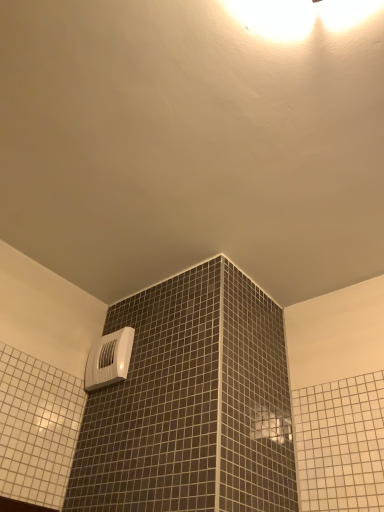
Identify the location of white plastic air conditioning unit at upper left. (109, 359).

The width and height of the screenshot is (384, 512). What do you see at coordinates (109, 359) in the screenshot?
I see `white plastic air conditioning unit at upper left` at bounding box center [109, 359].

This screenshot has height=512, width=384. In order to click on white plastic air conditioning unit at upper left in this screenshot , I will do `click(109, 359)`.